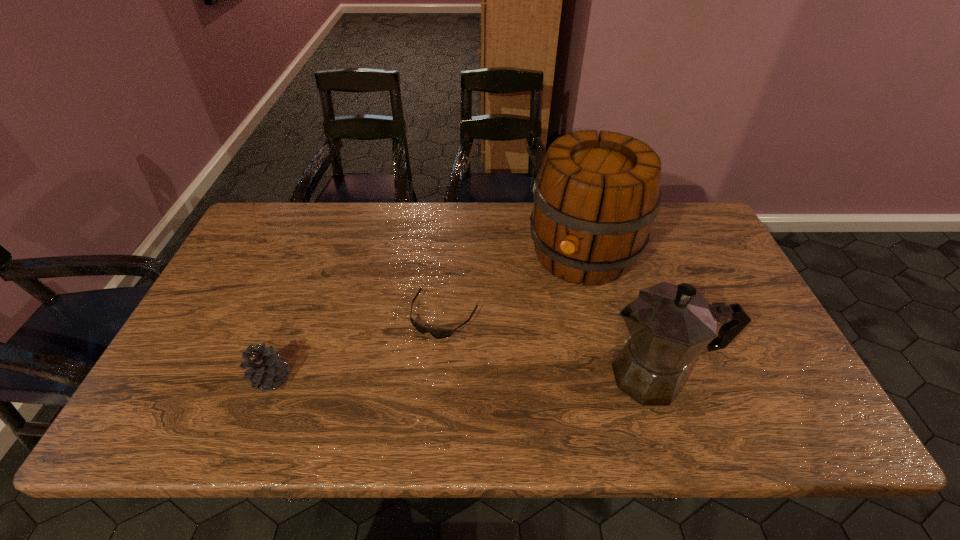
The height and width of the screenshot is (540, 960). In order to click on vacant space on the desktop that is between the second shortest object and the coffeepot and is positioned on the side of the cider where the spigot is located in this screenshot , I will do `click(514, 377)`.

The width and height of the screenshot is (960, 540). Identify the location of free spot on the desktop that is between the third tallest object and the coffeepot and is positioned on the front-facing side of the sunglasses. (408, 378).